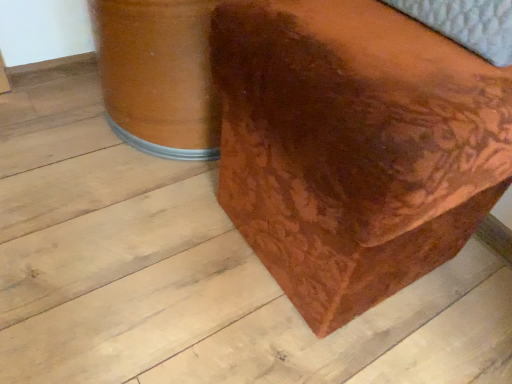
Find the location of a particular element. brown leather ottoman at center is located at coordinates (353, 147).

Describe the element at coordinates (353, 147) in the screenshot. I see `brown leather ottoman at center` at that location.

Where is `brown leather ottoman at center`? The image size is (512, 384). brown leather ottoman at center is located at coordinates (353, 147).